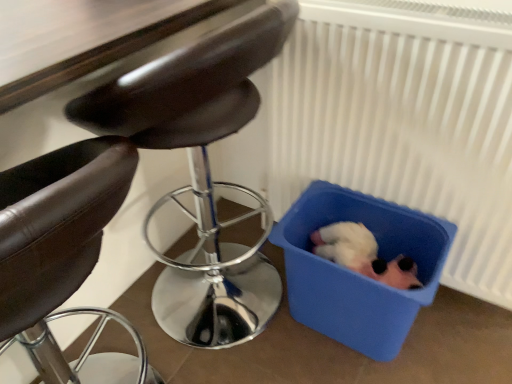
Question: Does white plastic radiator at lower right turn towards blue plastic bin at lower right?

Choices:
 (A) yes
 (B) no

Answer: (A)

Question: Is white plastic radiator at lower right far from blue plastic bin at lower right?

Choices:
 (A) no
 (B) yes

Answer: (A)

Question: Is white plastic radiator at lower right positioned with its back to blue plastic bin at lower right?

Choices:
 (A) no
 (B) yes

Answer: (B)

Question: From the image's perspective, would you say white plastic radiator at lower right is shown under blue plastic bin at lower right?

Choices:
 (A) yes
 (B) no

Answer: (B)

Question: Is white plastic radiator at lower right bigger than blue plastic bin at lower right?

Choices:
 (A) no
 (B) yes

Answer: (B)

Question: From the image's perspective, is leather-like black chair at left, acting as the 1th chair starting from the left, positioned above or below leather-like brown chair at center, marked as the second chair in a left-to-right arrangement?

Choices:
 (A) below
 (B) above

Answer: (A)

Question: From a real-world perspective, is leather-like black chair at left, acting as the 1th chair starting from the left, positioned above or below leather-like brown chair at center, which appears as the first chair when viewed from the right?

Choices:
 (A) above
 (B) below

Answer: (B)

Question: In the image, is leather-like black chair at left, which is counted as the 2th chair, starting from the right, positioned in front of or behind leather-like brown chair at center, marked as the second chair in a left-to-right arrangement?

Choices:
 (A) front
 (B) behind

Answer: (A)

Question: Looking at their shapes, would you say leather-like black chair at left, acting as the 1th chair starting from the left, is wider or thinner than leather-like brown chair at center, which appears as the first chair when viewed from the right?

Choices:
 (A) wide
 (B) thin

Answer: (B)

Question: From a real-world perspective, is leather-like brown chair at center, which appears as the first chair when viewed from the right, above or below blue plastic bin at lower right?

Choices:
 (A) below
 (B) above

Answer: (B)

Question: Choose the correct answer: Is leather-like brown chair at center, which appears as the first chair when viewed from the right, inside blue plastic bin at lower right or outside it?

Choices:
 (A) outside
 (B) inside

Answer: (A)

Question: Is leather-like brown chair at center, which appears as the first chair when viewed from the right, in front of or behind blue plastic bin at lower right in the image?

Choices:
 (A) behind
 (B) front

Answer: (B)

Question: Considering the positions of point (186, 59) and point (419, 271), is point (186, 59) closer or farther from the camera than point (419, 271)?

Choices:
 (A) closer
 (B) farther

Answer: (A)

Question: Is white plastic radiator at lower right bigger or smaller than leather-like brown chair at center, marked as the second chair in a left-to-right arrangement?

Choices:
 (A) small
 (B) big

Answer: (A)

Question: Do you think white plastic radiator at lower right is within leather-like brown chair at center, marked as the second chair in a left-to-right arrangement, or outside of it?

Choices:
 (A) inside
 (B) outside

Answer: (B)